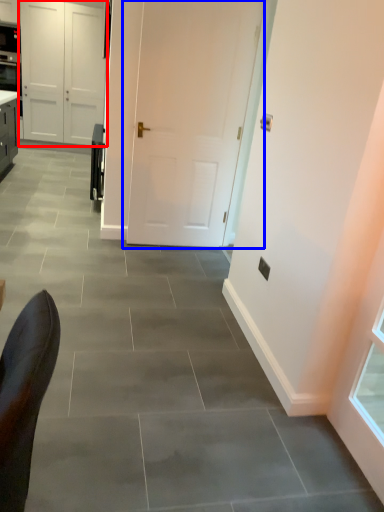
Question: Which point is further to the camera, door (highlighted by a red box) or door (highlighted by a blue box)?

Choices:
 (A) door
 (B) door

Answer: (A)